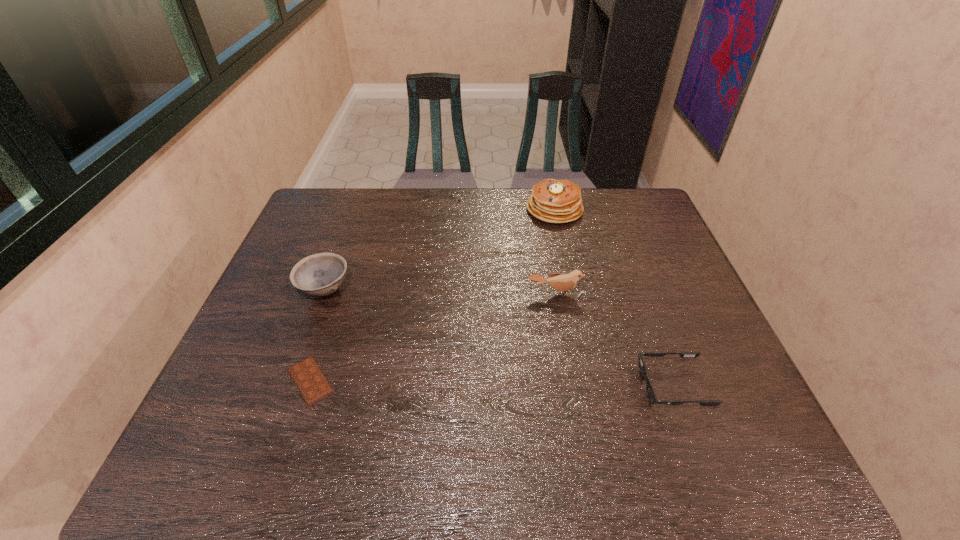
This screenshot has width=960, height=540. I want to click on free space between the shortest object and the rightmost object, so click(492, 383).

Locate an element on the screen. Image resolution: width=960 pixels, height=540 pixels. vacant region between the shortest object and the bowl is located at coordinates pyautogui.click(x=318, y=335).

The width and height of the screenshot is (960, 540). What are the coordinates of `free space between the bird and the second shortest object` in the screenshot? It's located at (614, 340).

Locate an element on the screen. Image resolution: width=960 pixels, height=540 pixels. object that ranks as the closest to the farthest object is located at coordinates (562, 282).

You are a GUI agent. You are given a task and a screenshot of the screen. Output one action in this format:
    pyautogui.click(x=<x>, y=<y>)
    Task: Click on the object that is the third closest one to the rightmost object
    
    Given the screenshot: What is the action you would take?
    pyautogui.click(x=309, y=379)